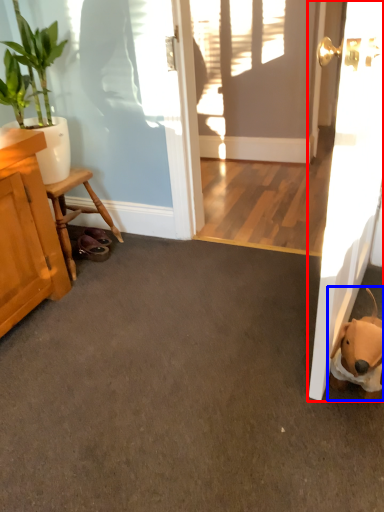
Question: Which of the following is the closest to the observer, door (highlighted by a red box) or animal (highlighted by a blue box)?

Choices:
 (A) door
 (B) animal

Answer: (A)